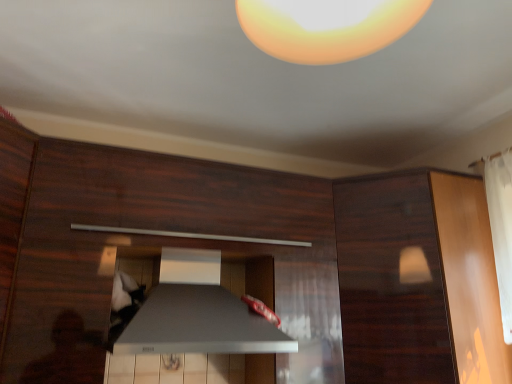
Question: Is dark wood cabinet at upper right wider or thinner than satin silver exhaust hood at center?

Choices:
 (A) thin
 (B) wide

Answer: (B)

Question: Relative to satin silver exhaust hood at center, is dark wood cabinet at upper right in front or behind?

Choices:
 (A) front
 (B) behind

Answer: (B)

Question: Estimate the real-world distances between objects in this image. Which object is farther from the satin silver exhaust hood at center?

Choices:
 (A) satin silver drawer at center
 (B) dark wood cabinet at upper right

Answer: (B)

Question: Which of these objects is positioned farthest from the dark wood cabinet at upper right?

Choices:
 (A) satin silver drawer at center
 (B) satin silver exhaust hood at center

Answer: (B)